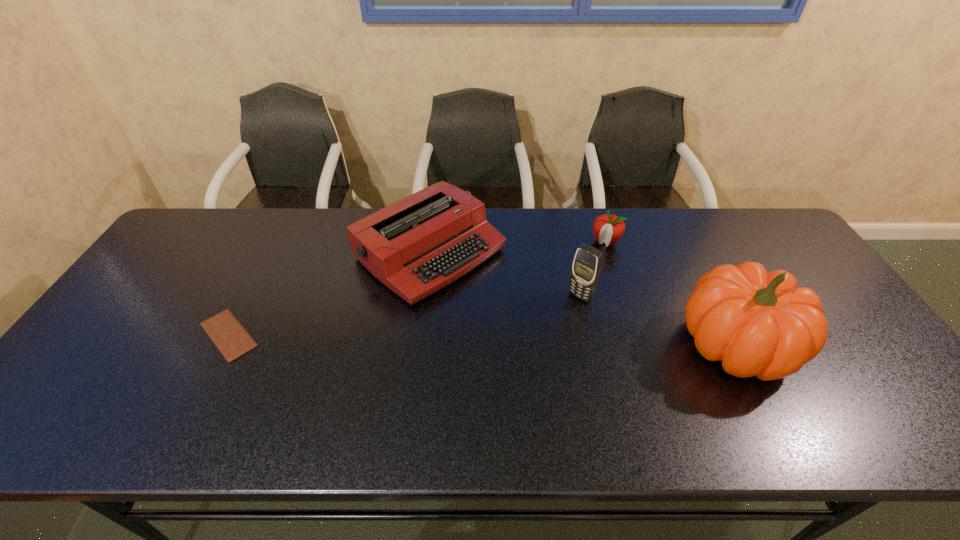
Image resolution: width=960 pixels, height=540 pixels. Find the location of `vacant area between the fourth object from right to left and the second tallest object`. vacant area between the fourth object from right to left and the second tallest object is located at coordinates (505, 275).

Where is `free space that is in between the cellular telephone and the chocolate bar`? The image size is (960, 540). free space that is in between the cellular telephone and the chocolate bar is located at coordinates (404, 315).

Find the location of a particular element. Image resolution: width=960 pixels, height=540 pixels. vacant space that is in between the chocolate bar and the rightmost object is located at coordinates (482, 340).

Locate an element on the screen. vacant space that is in between the rightmost object and the fourth object from left to right is located at coordinates (671, 293).

Identify the location of object that can be found as the third closest to the fourth shortest object. (758, 324).

The width and height of the screenshot is (960, 540). Find the location of `the third closest object to the typewriter`. the third closest object to the typewriter is located at coordinates (608, 228).

Locate an element on the screen. vacant area in the image that satisfies the following two spatial constraints: 1. on the back side of the shortest object; 2. on the right side of the apple is located at coordinates (276, 242).

This screenshot has width=960, height=540. What are the coordinates of `free space that satisfies the following two spatial constraints: 1. on the front side of the third object from left to right; 2. on the right side of the rightmost object` in the screenshot? It's located at (591, 344).

I want to click on free space that satisfies the following two spatial constraints: 1. on the back side of the apple; 2. on the right side of the cellular telephone, so click(568, 242).